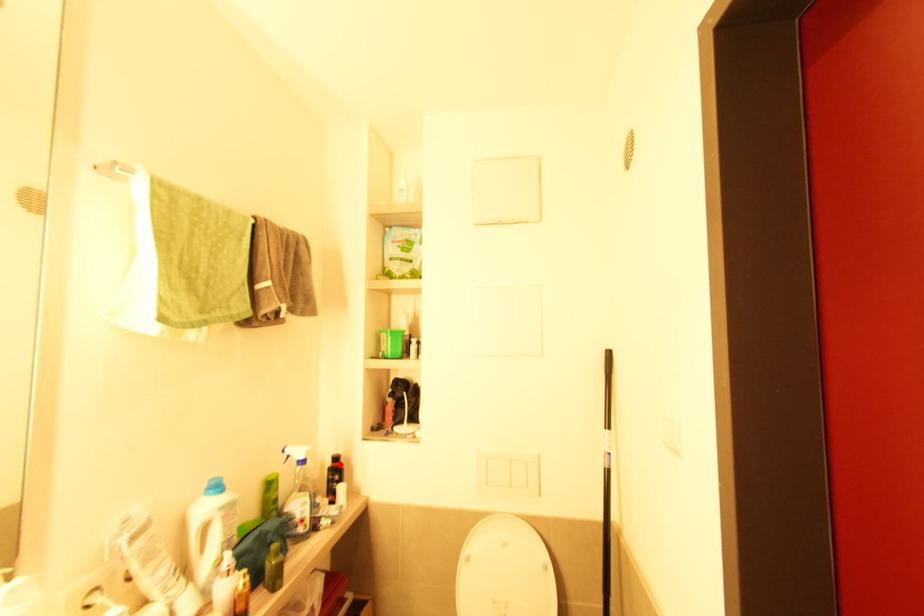
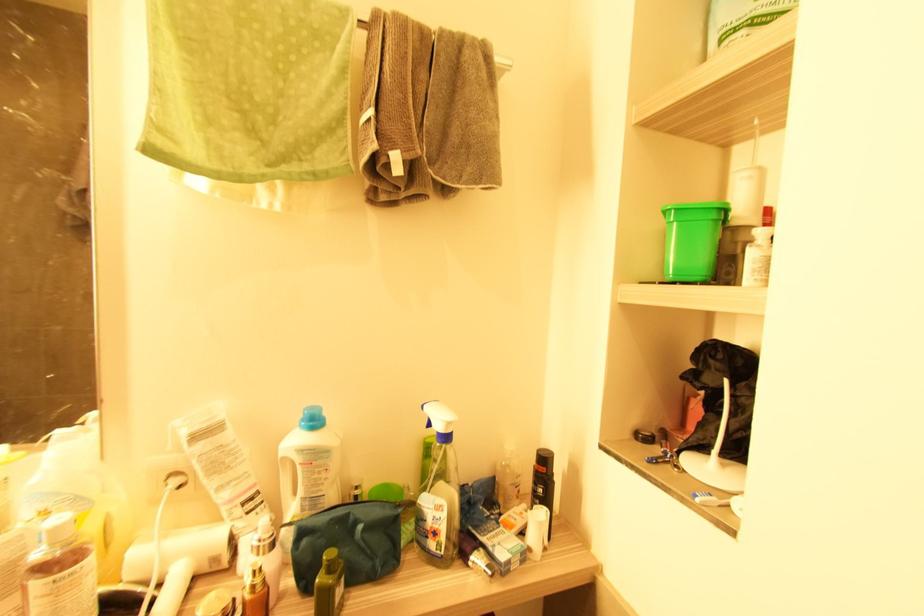
In the second image, find the point that corresponds to the highlighted location in the first image.

(545, 469)